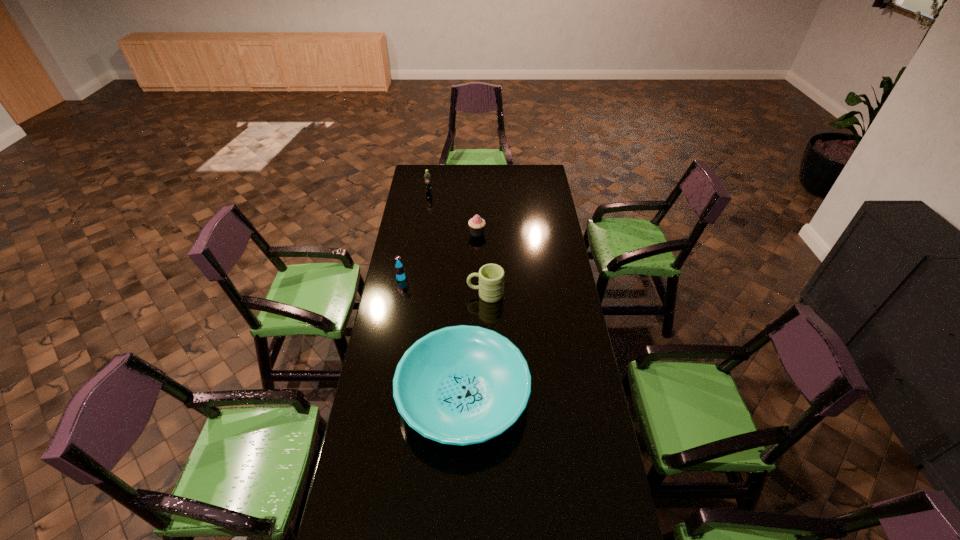
You are a GUI agent. You are given a task and a screenshot of the screen. Output one action in this format:
    pyautogui.click(x=<x>, y=<y>)
    Task: Click on the free spot located on the side of the fourth farthest object with the handle
    
    Given the screenshot: What is the action you would take?
    pyautogui.click(x=394, y=294)

You are a GUI agent. You are given a task and a screenshot of the screen. Output one action in this format:
    pyautogui.click(x=<x>, y=<y>)
    Task: Click on the vacant position located 0.060m on the front of the nearer soda
    
    Given the screenshot: What is the action you would take?
    pyautogui.click(x=398, y=293)

Find the location of a particular element. The width and height of the screenshot is (960, 540). blank space located on the right of the cupcake is located at coordinates (507, 233).

Locate an element on the screen. The height and width of the screenshot is (540, 960). vacant space located on the right of the dish is located at coordinates (572, 395).

Locate an element on the screen. The width and height of the screenshot is (960, 540). dish present at the left edge is located at coordinates click(460, 385).

Identify the location of vacant area at the left edge of the desktop. (382, 428).

I want to click on vacant space at the right edge of the desktop, so click(570, 379).

The width and height of the screenshot is (960, 540). Identify the location of free space at the far right corner. (540, 176).

Where is `vacant area that lies between the right soda and the mug`? The width and height of the screenshot is (960, 540). vacant area that lies between the right soda and the mug is located at coordinates (457, 243).

Locate an element on the screen. empty space between the right soda and the nearest object is located at coordinates (446, 294).